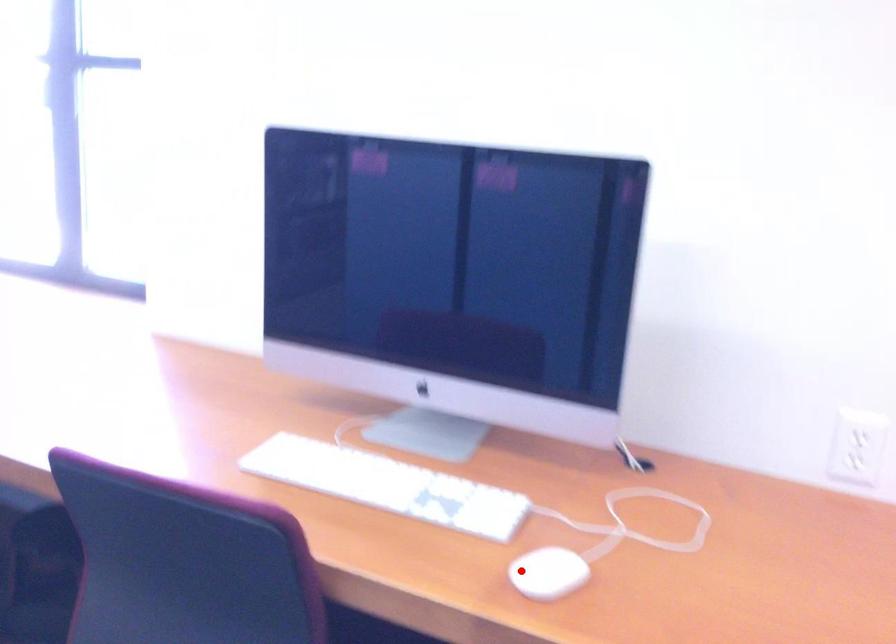
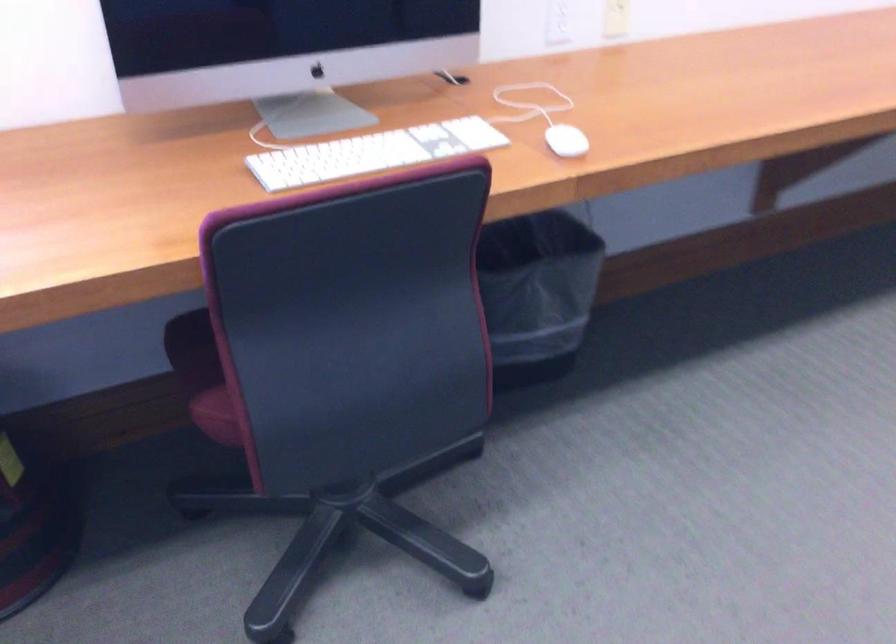
Question: I am providing you with two images of the same scene from different viewpoints. A red point is marked on the first image. Can you still see the location of the red point in image 2?

Choices:
 (A) Yes
 (B) No

Answer: (A)